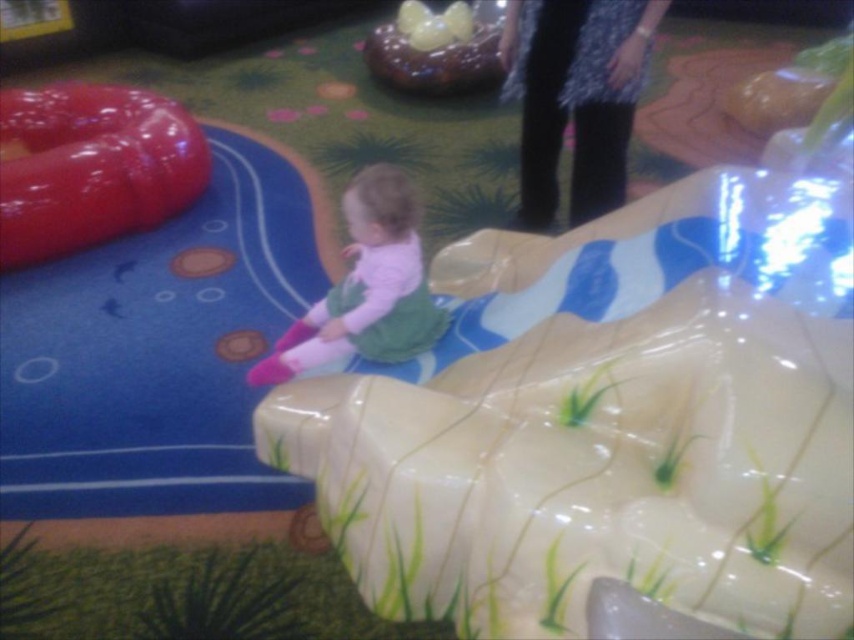
Does pink fabric toddler at center appear on the left side of shiny chocolate cake at upper center?

Yes, pink fabric toddler at center is to the left of shiny chocolate cake at upper center.

Who is more forward, (x=366, y=176) or (x=478, y=26)?

Point (x=366, y=176) is more forward.

Where is `pink fabric toddler at center`? The width and height of the screenshot is (854, 640). pink fabric toddler at center is located at coordinates (366, 288).

Is point (142, 163) positioned after point (402, 300)?

Yes, point (142, 163) is behind point (402, 300).

Does glossy plastic slide at left appear over pink fabric toddler at center?

Yes, glossy plastic slide at left is above pink fabric toddler at center.

This screenshot has height=640, width=854. In order to click on glossy plastic slide at left in this screenshot , I will do `click(91, 166)`.

Can you confirm if glossy plastic slide at left is shorter than shiny chocolate cake at upper center?

No, glossy plastic slide at left is not shorter than shiny chocolate cake at upper center.

Which is behind, point (127, 214) or point (375, 38)?

The point (375, 38) is behind.

The image size is (854, 640). Find the location of `glossy plastic slide at left`. glossy plastic slide at left is located at coordinates (91, 166).